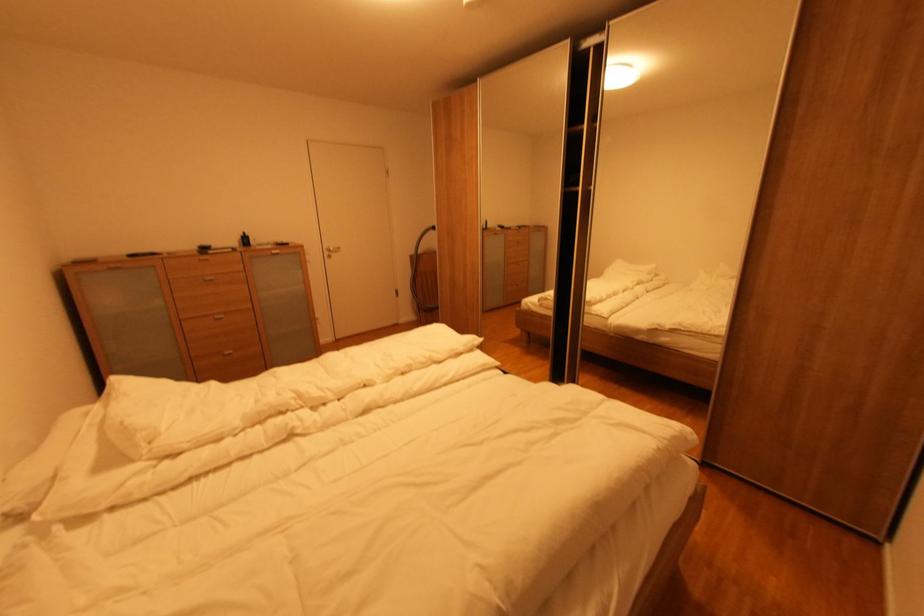
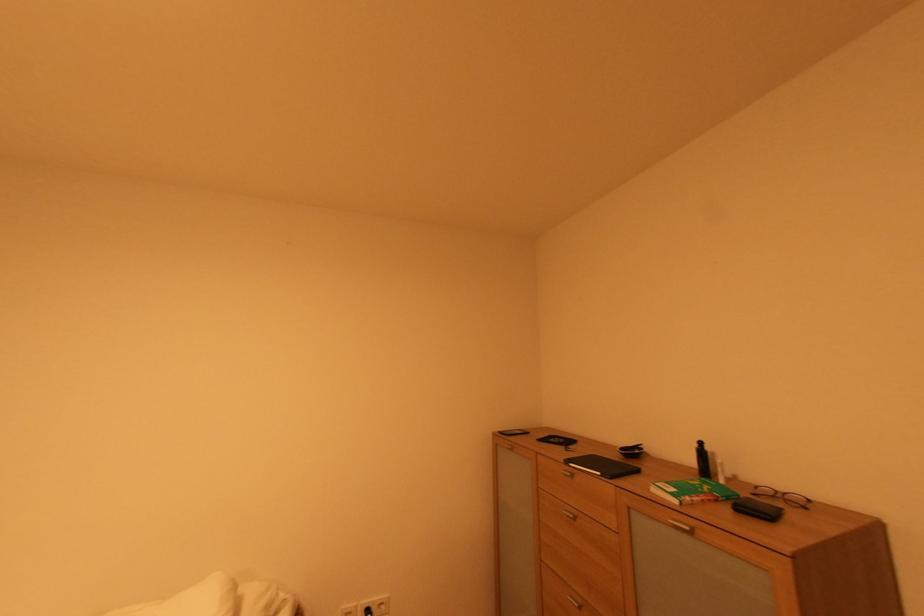
In the second image, find the point that corresponds to point 248,237 in the first image.

(701, 447)